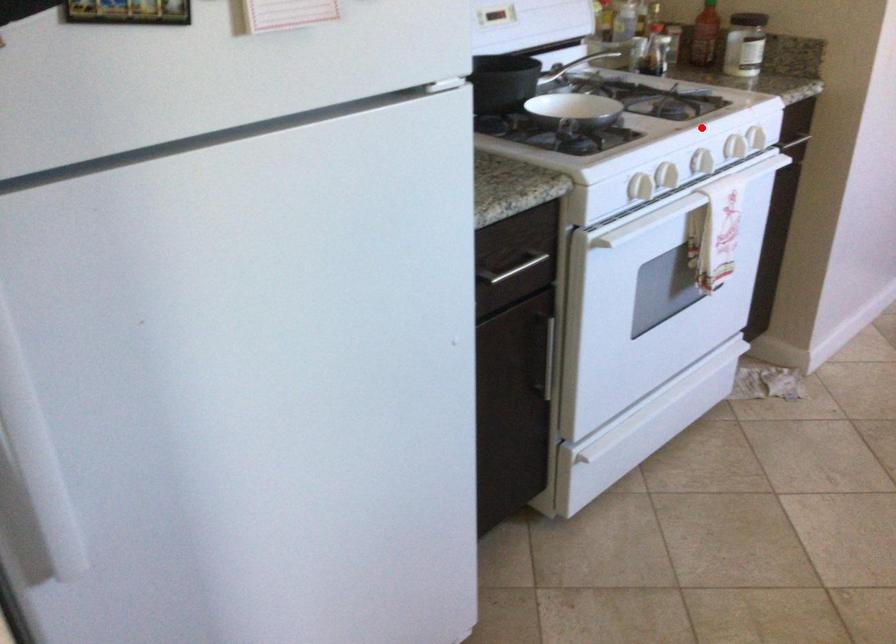
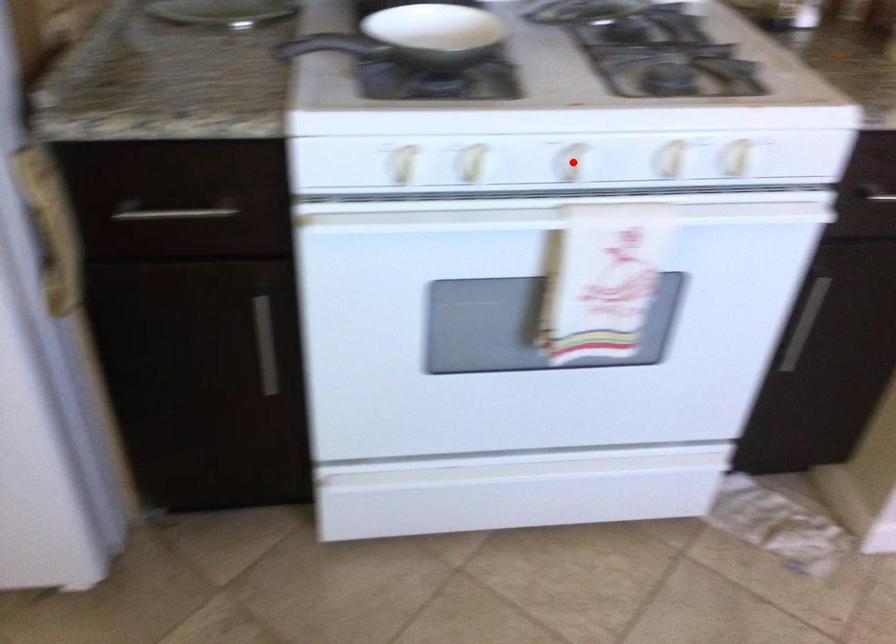
I am providing you with two images of the same scene from different viewpoints. A red point is marked on the first image and another point is marked on the second image. Does the point marked in image1 correspond to the same location as the one in image2?

Yes